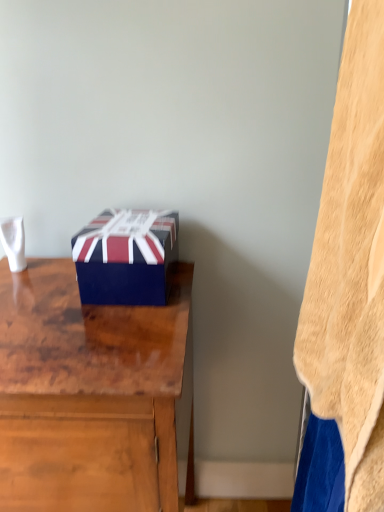
Question: From the image's perspective, is beige fleece blanket at right located beneath wooden desk at center?

Choices:
 (A) no
 (B) yes

Answer: (A)

Question: Is beige fleece blanket at right smaller than wooden desk at center?

Choices:
 (A) no
 (B) yes

Answer: (B)

Question: Can you confirm if beige fleece blanket at right is thinner than wooden desk at center?

Choices:
 (A) yes
 (B) no

Answer: (A)

Question: Can wooden desk at center be found inside beige fleece blanket at right?

Choices:
 (A) yes
 (B) no

Answer: (B)

Question: From a real-world perspective, is beige fleece blanket at right on top of wooden desk at center?

Choices:
 (A) yes
 (B) no

Answer: (A)

Question: From their relative heights in the image, would you say blue glossy box at center is taller or shorter than beige fleece blanket at right?

Choices:
 (A) tall
 (B) short

Answer: (B)

Question: From the image's perspective, is blue glossy box at center positioned above or below beige fleece blanket at right?

Choices:
 (A) below
 (B) above

Answer: (B)

Question: In the image, is blue glossy box at center on the left side or the right side of beige fleece blanket at right?

Choices:
 (A) left
 (B) right

Answer: (A)

Question: Considering the positions of blue glossy box at center and beige fleece blanket at right in the image, is blue glossy box at center bigger or smaller than beige fleece blanket at right?

Choices:
 (A) small
 (B) big

Answer: (A)

Question: In terms of height, does blue glossy box at center look taller or shorter compared to wooden desk at center?

Choices:
 (A) tall
 (B) short

Answer: (B)

Question: Choose the correct answer: Is blue glossy box at center inside wooden desk at center or outside it?

Choices:
 (A) inside
 (B) outside

Answer: (B)

Question: Considering the relative positions of blue glossy box at center and wooden desk at center in the image provided, is blue glossy box at center to the left or to the right of wooden desk at center?

Choices:
 (A) right
 (B) left

Answer: (A)

Question: In terms of size, does blue glossy box at center appear bigger or smaller than wooden desk at center?

Choices:
 (A) big
 (B) small

Answer: (B)

Question: Looking at the image, does beige fleece blanket at right seem bigger or smaller compared to blue glossy box at center?

Choices:
 (A) small
 (B) big

Answer: (B)

Question: From the image's perspective, relative to blue glossy box at center, is beige fleece blanket at right above or below?

Choices:
 (A) above
 (B) below

Answer: (B)